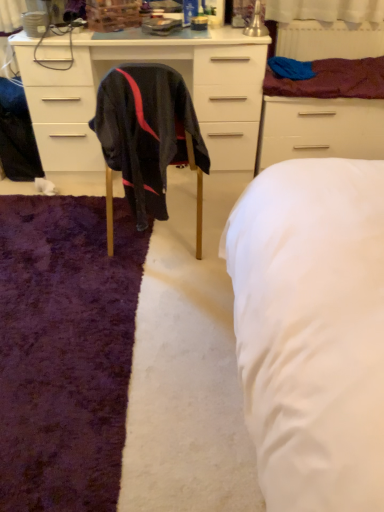
Question: From a real-world perspective, is maroon fabric at upper right on top of matte black cabinet at center?

Choices:
 (A) no
 (B) yes

Answer: (B)

Question: Can you confirm if maroon fabric at upper right is thinner than matte black cabinet at center?

Choices:
 (A) no
 (B) yes

Answer: (B)

Question: Can you confirm if maroon fabric at upper right is shorter than matte black cabinet at center?

Choices:
 (A) no
 (B) yes

Answer: (B)

Question: From the image's perspective, is maroon fabric at upper right located beneath matte black cabinet at center?

Choices:
 (A) no
 (B) yes

Answer: (A)

Question: Is maroon fabric at upper right taller than matte black cabinet at center?

Choices:
 (A) yes
 (B) no

Answer: (B)

Question: Is matte black cabinet at center located within maroon fabric at upper right?

Choices:
 (A) no
 (B) yes

Answer: (A)

Question: Considering the relative positions of purple shaggy rug at lower left and maroon fabric at upper right in the image provided, is purple shaggy rug at lower left behind maroon fabric at upper right?

Choices:
 (A) no
 (B) yes

Answer: (A)

Question: Does purple shaggy rug at lower left have a larger size compared to maroon fabric at upper right?

Choices:
 (A) yes
 (B) no

Answer: (A)

Question: From the image's perspective, is purple shaggy rug at lower left located beneath maroon fabric at upper right?

Choices:
 (A) yes
 (B) no

Answer: (A)

Question: Is purple shaggy rug at lower left facing away from maroon fabric at upper right?

Choices:
 (A) yes
 (B) no

Answer: (B)

Question: Does purple shaggy rug at lower left have a greater width compared to maroon fabric at upper right?

Choices:
 (A) no
 (B) yes

Answer: (B)

Question: Can you confirm if purple shaggy rug at lower left is shorter than maroon fabric at upper right?

Choices:
 (A) no
 (B) yes

Answer: (B)

Question: Is maroon fabric at upper right turned away from white matte drawer at upper right?

Choices:
 (A) no
 (B) yes

Answer: (A)